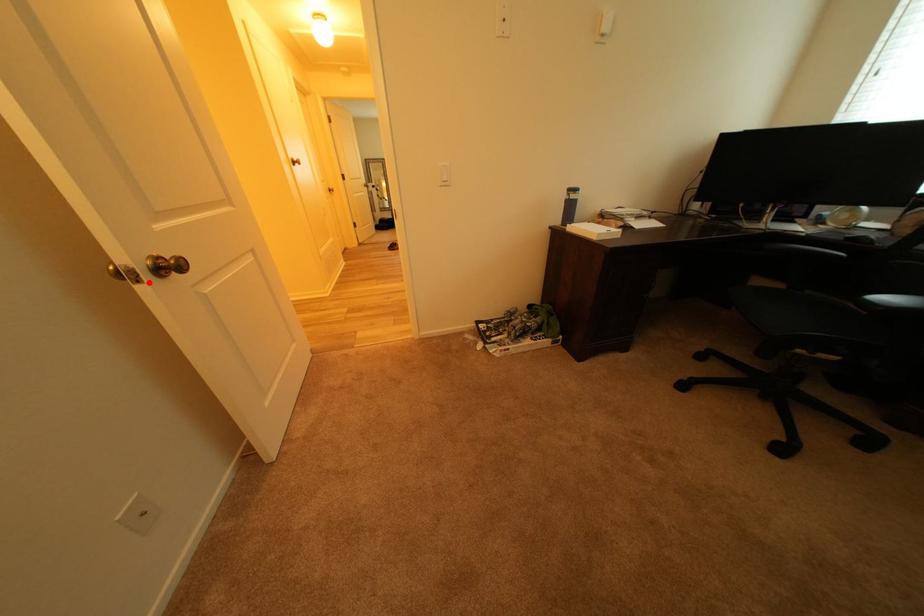
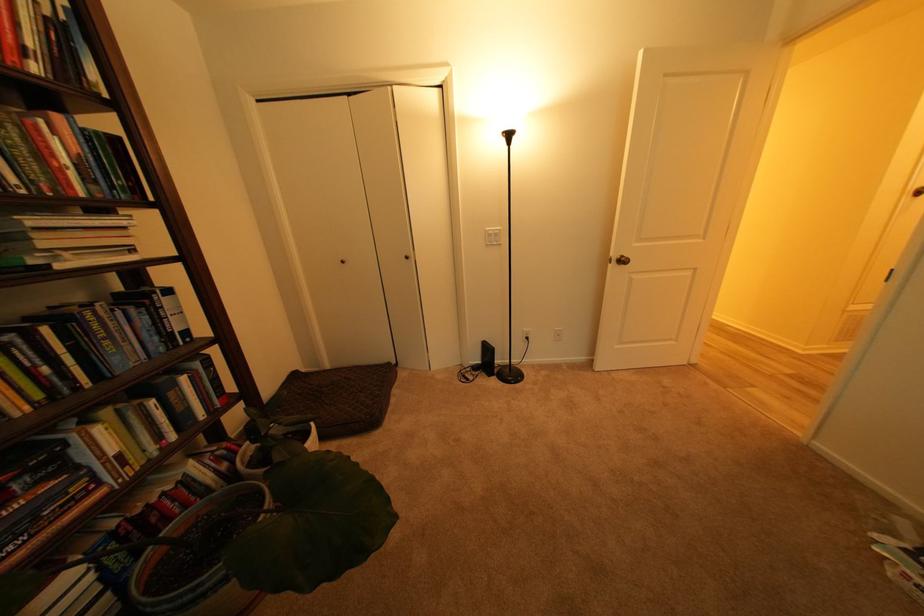
In the second image, find the point that corresponds to the highlighted location in the first image.

(621, 265)